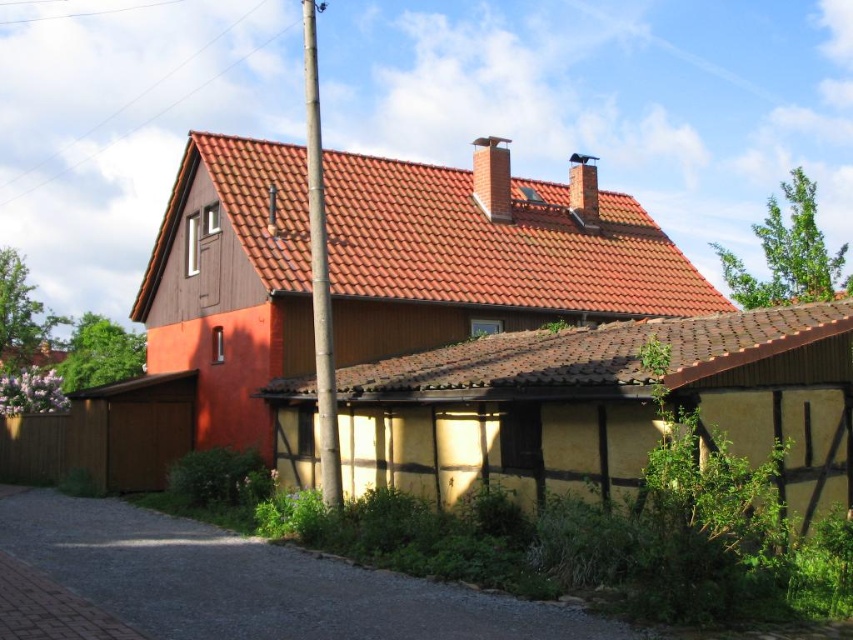
Who is higher up, smooth gray chimney at upper center or smooth brick chimney at upper center?

smooth gray chimney at upper center is above.

Is smooth gray chimney at upper center below smooth brick chimney at upper center?

Actually, smooth gray chimney at upper center is above smooth brick chimney at upper center.

In order to click on smooth gray chimney at upper center in this screenshot , I will do `click(491, 177)`.

Find the location of a particular element. smooth gray chimney at upper center is located at coordinates (491, 177).

Which is below, smooth bamboo pole at center or smooth brick chimney at upper center?

smooth brick chimney at upper center is lower down.

Between point (322, 368) and point (590, 166), which one is positioned in front?

Point (322, 368) is more forward.

The width and height of the screenshot is (853, 640). In order to click on smooth bamboo pole at center in this screenshot , I will do `click(318, 275)`.

Is smooth bamboo pole at center positioned in front of smooth gray chimney at upper center?

Yes, it is in front of smooth gray chimney at upper center.

Based on the photo, can you confirm if smooth bamboo pole at center is taller than smooth gray chimney at upper center?

Yes.

This screenshot has height=640, width=853. What are the coordinates of `smooth bamboo pole at center` in the screenshot? It's located at (318, 275).